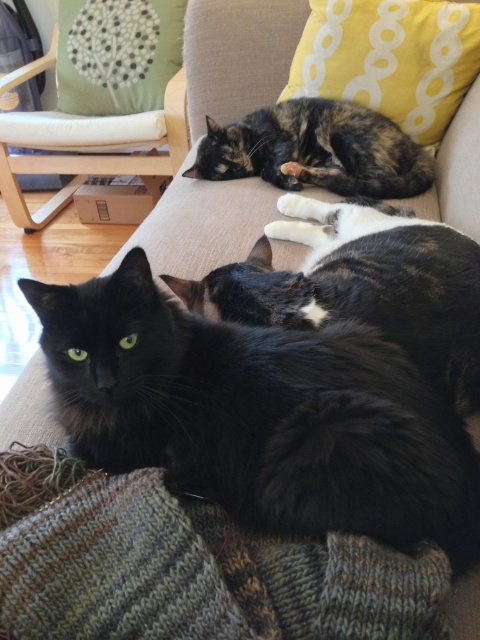
You are a small toy mouse that wants to move from the yellow dotted pillow at upper right to the tortoiseshell fur cat at upper center. Since you can only move forward, will you be able to reach the cat without moving backward?

The yellow dotted pillow at upper right is closer to the viewer than tortoiseshell fur cat at upper center, so moving forward from the pillow will take you away from the cat. Therefore, you cannot reach the cat without moving backward.

You are a cat owner who wants to place a new cat toy on the sofa where both cats are. The toy requires a space taller than the black fluffy cat at center. Can the green fabric pillow at upper left accommodate the toy?

The black fluffy cat at center is not as tall as the green fabric pillow at upper left, so the green fabric pillow at upper left can accommodate the toy since it is taller than the black fluffy cat at center.